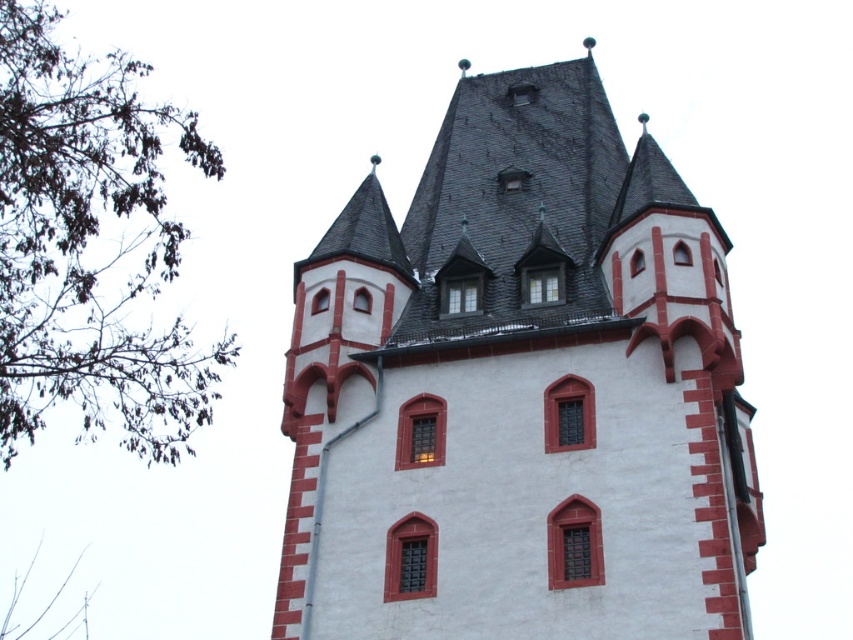
You are an architect analyzing the image of a historic building. You need to determine which object takes up more area in the image between the white stucco tower at center and the green leafy branches at left. Based on the scene description, which one occupies a larger portion of the image?

The green leafy branches at left occupy more space in the image than the white stucco tower at center, as stated in the objects description that the white stucco tower at center occupies less space than green leafy branches at left.

You are an architect assessing the historic building. From your vantage point, which object is taller between the white stucco tower at center and the green leafy branches at left?

The green leafy branches at left are taller than the white stucco tower at center.

You are a painter standing at the base of the white stucco tower at center, and you want to paint the green leafy branches at left. Given that your ladder can reach up to 100 feet, will you be able to reach the branches?

The white stucco tower at center is 101.61 feet from green leafy branches at left. Since the ladder can only reach up to 100 feet, you will not be able to reach the branches.